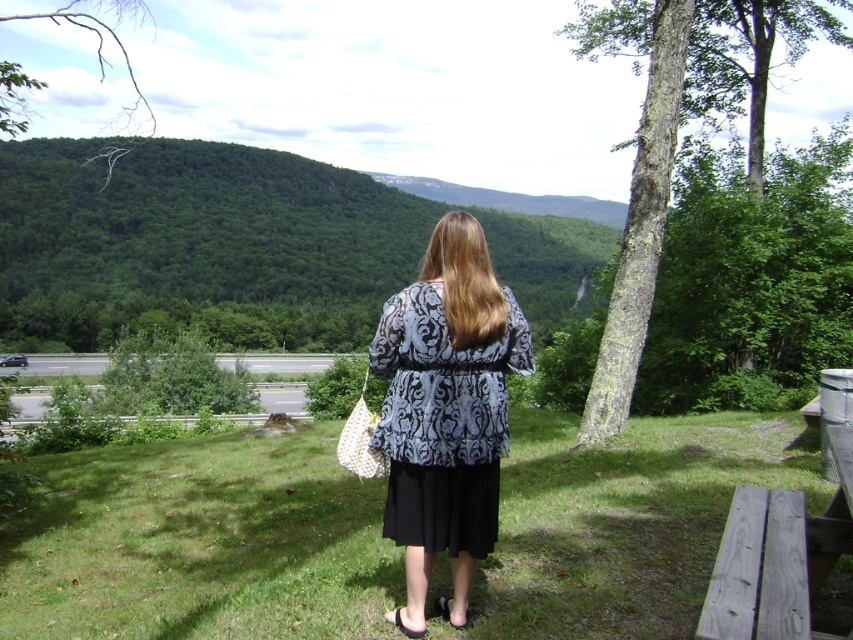
Question: Estimate the real-world distances between objects in this image. Which object is closer to the white floral fabric handbag at center?

Choices:
 (A) green rough bark tree at upper right
 (B) grayish-brown bark tree at right
 (C) patterned fabric dress at center

Answer: (C)

Question: Among these objects, which one is nearest to the camera?

Choices:
 (A) green rough bark tree at upper right
 (B) grayish-brown bark tree at right
 (C) green grass at center

Answer: (C)

Question: Which point appears farthest from the camera in this image?

Choices:
 (A) (764, 442)
 (B) (712, 586)
 (C) (628, 264)
 (D) (375, 420)

Answer: (C)

Question: Does green rough bark tree at upper right appear over gray wood picnic table at lower right?

Choices:
 (A) yes
 (B) no

Answer: (A)

Question: Does green grass at center have a greater width compared to patterned fabric dress at center?

Choices:
 (A) no
 (B) yes

Answer: (B)

Question: Does green rough bark tree at upper right lie behind white floral fabric handbag at center?

Choices:
 (A) yes
 (B) no

Answer: (A)